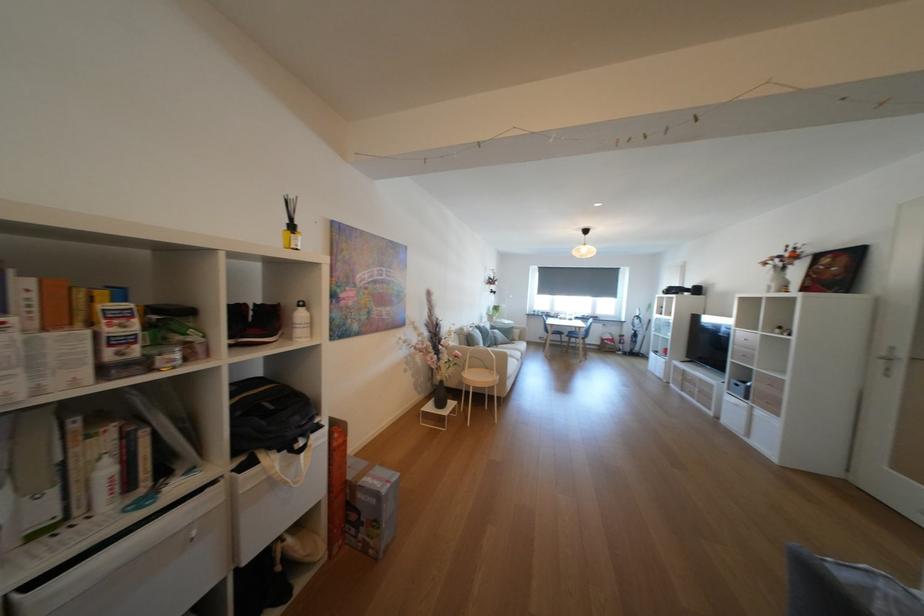
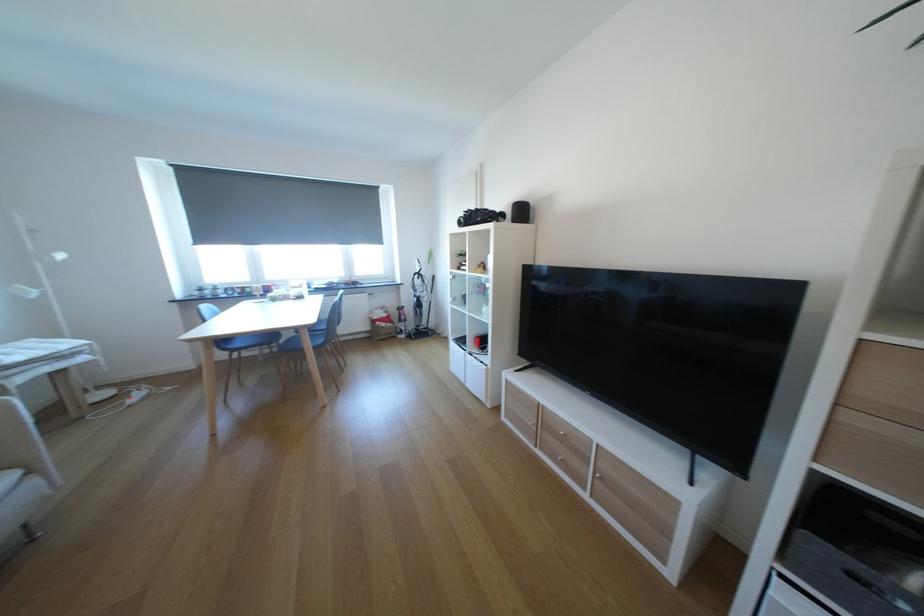
In the second image, find the point that corresponds to (x=610, y=344) in the first image.

(379, 329)